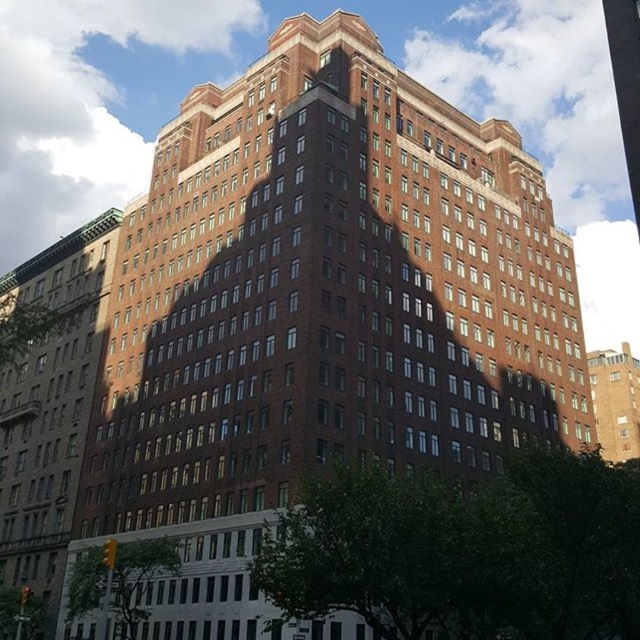
Does brown brick building at center have a lesser height compared to brown brick building at right?

No.

Between point (38, 552) and point (595, 364), which one is positioned in front?

Point (38, 552) is in front.

Where is `brown brick building at center`? brown brick building at center is located at coordinates (51, 406).